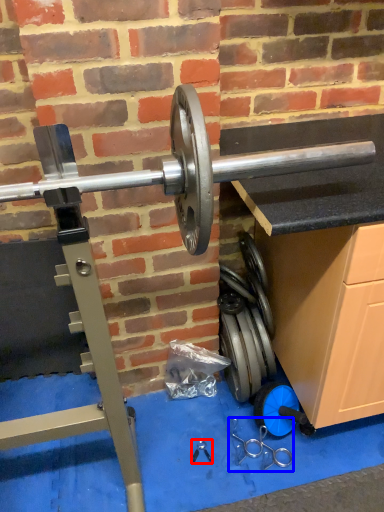
Question: Which object is closer to the camera taking this photo, tool (highlighted by a red box) or tool (highlighted by a blue box)?

Choices:
 (A) tool
 (B) tool

Answer: (B)